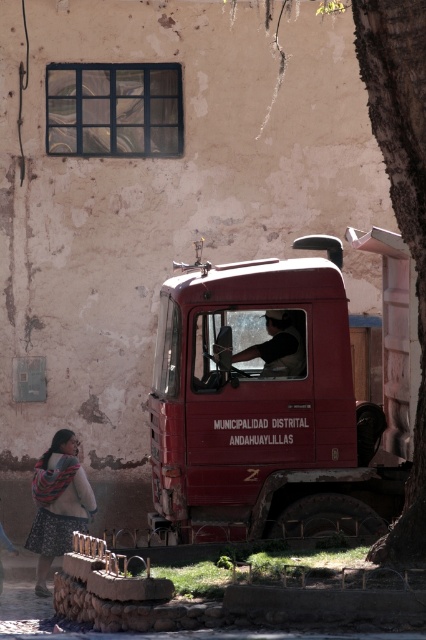
You are standing in front of the beige wall with the window and the tree trunk. There are two points marked on the image, point 1 at coordinates (396, 17) and point 2 at (218, 355). Which point is closer to you?

Point 1 at coordinates (396, 17) is closer to the viewer than point 2 at (218, 355).

You are standing in front of the beige wall and want to place a new poster. The poster needs to be placed at the same location as the floral skirt at lower left. What coordinates should you use?

The floral skirt at lower left is located at coordinates point (57,502), so you should place the poster at those coordinates.